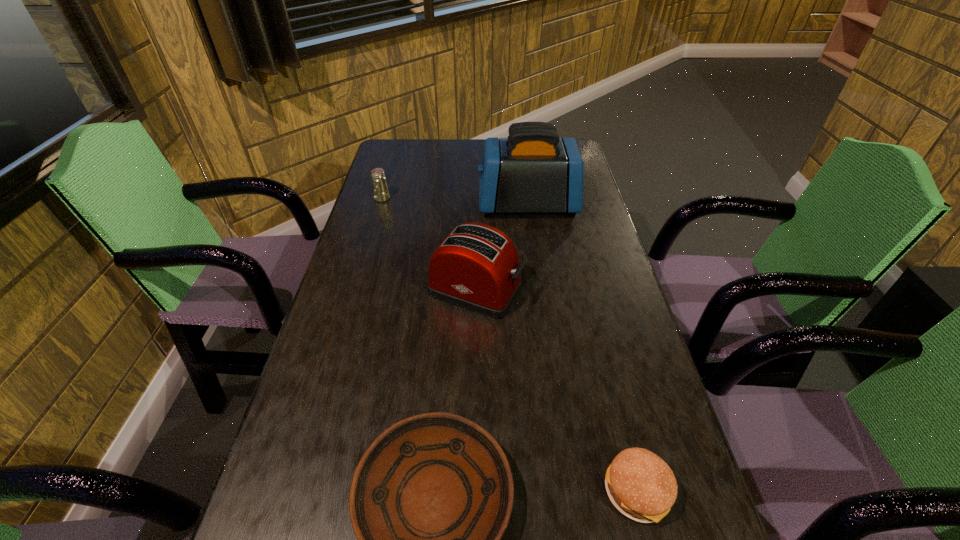
Locate an element on the screen. free space between the nearer toaster and the hamburger is located at coordinates (556, 390).

Locate an element on the screen. This screenshot has width=960, height=540. free space between the third shortest object and the hamburger is located at coordinates tap(510, 345).

Locate an element on the screen. Image resolution: width=960 pixels, height=540 pixels. vacant area that lies between the hamburger and the shorter toaster is located at coordinates [556, 390].

Identify the location of unoccupied position between the tallest object and the hamburger. This screenshot has height=540, width=960. (582, 348).

Identify which object is located as the second nearest to the hamburger. Please provide its 2D coordinates. Your answer should be formatted as a tuple, i.e. [(x, y)], where the tuple contains the x and y coordinates of a point satisfying the conditions above.

[(476, 267)]

Where is `object that stands as the third closest to the tallest object`? object that stands as the third closest to the tallest object is located at coordinates (431, 497).

Where is `free space that satisfies the following two spatial constraints: 1. on the front-facing side of the tallest object; 2. on the back side of the hamburger`? free space that satisfies the following two spatial constraints: 1. on the front-facing side of the tallest object; 2. on the back side of the hamburger is located at coordinates (567, 491).

Locate an element on the screen. Image resolution: width=960 pixels, height=540 pixels. free spot that satisfies the following two spatial constraints: 1. on the front side of the fourth shortest object; 2. on the right side of the hamburger is located at coordinates (473, 491).

Locate an element on the screen. The image size is (960, 540). blank space that satisfies the following two spatial constraints: 1. on the front-facing side of the farther toaster; 2. on the front side of the fourth shortest object is located at coordinates (540, 289).

Identify the location of free space that satisfies the following two spatial constraints: 1. on the front-facing side of the tallest object; 2. on the left side of the hamburger. (567, 491).